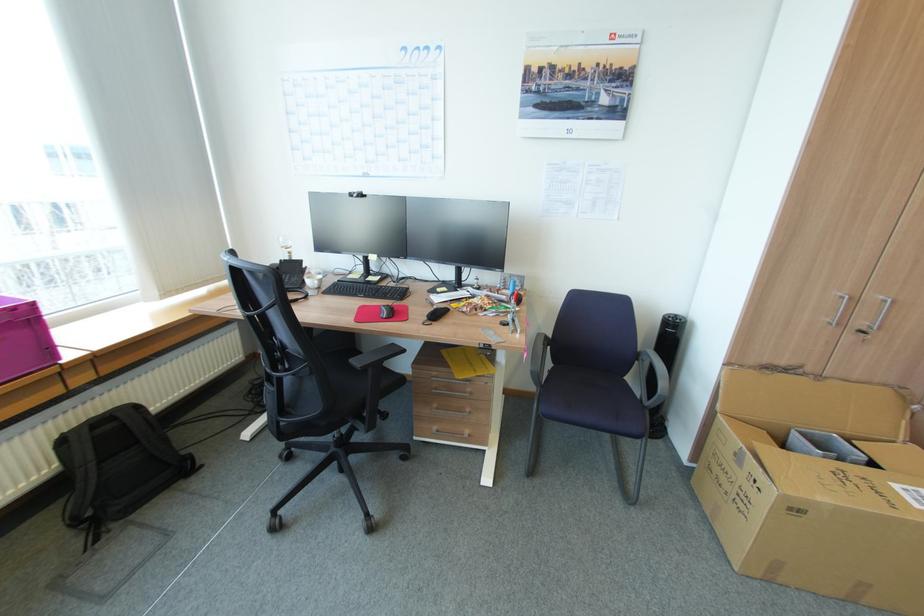
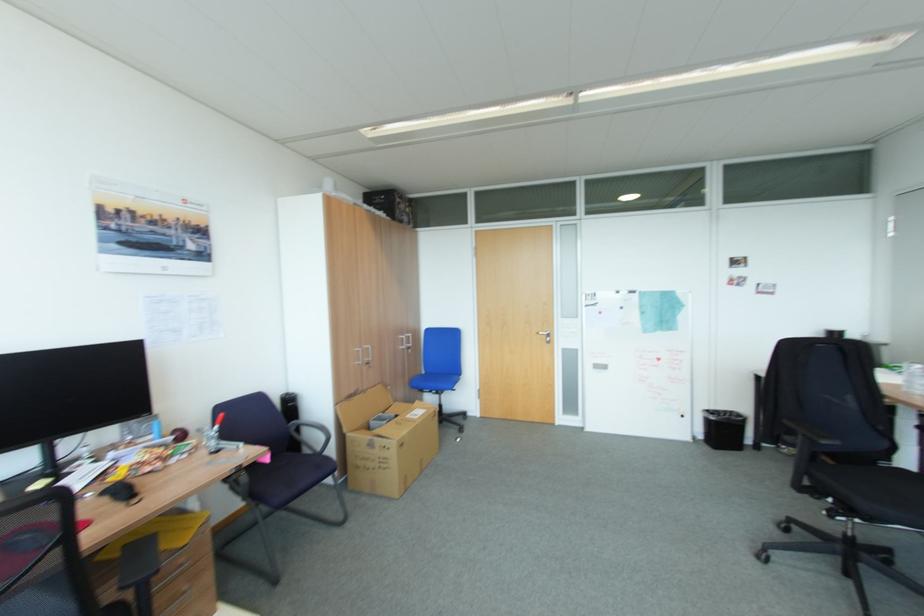
The point at (865, 323) is marked in the first image. Where is the corresponding point in the second image?

(371, 360)